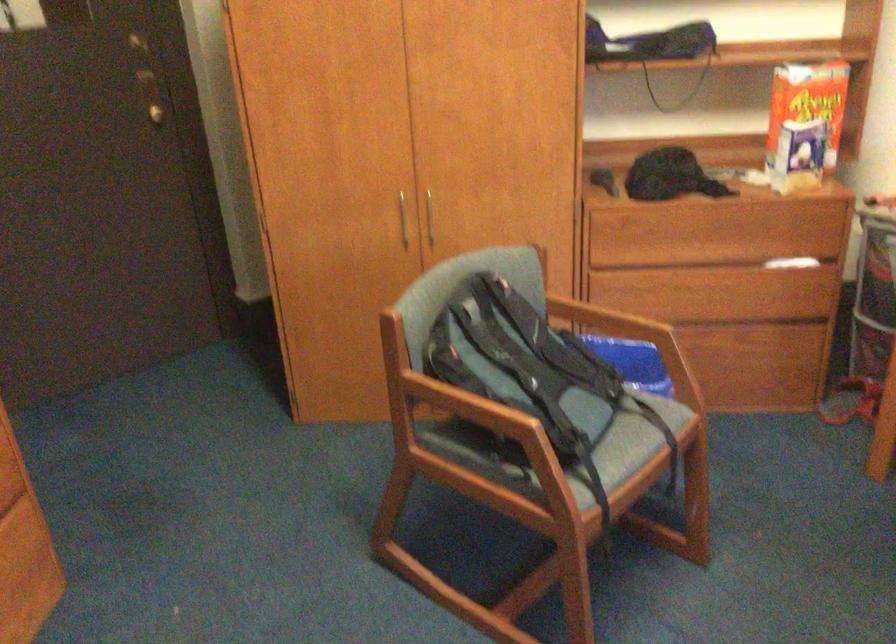
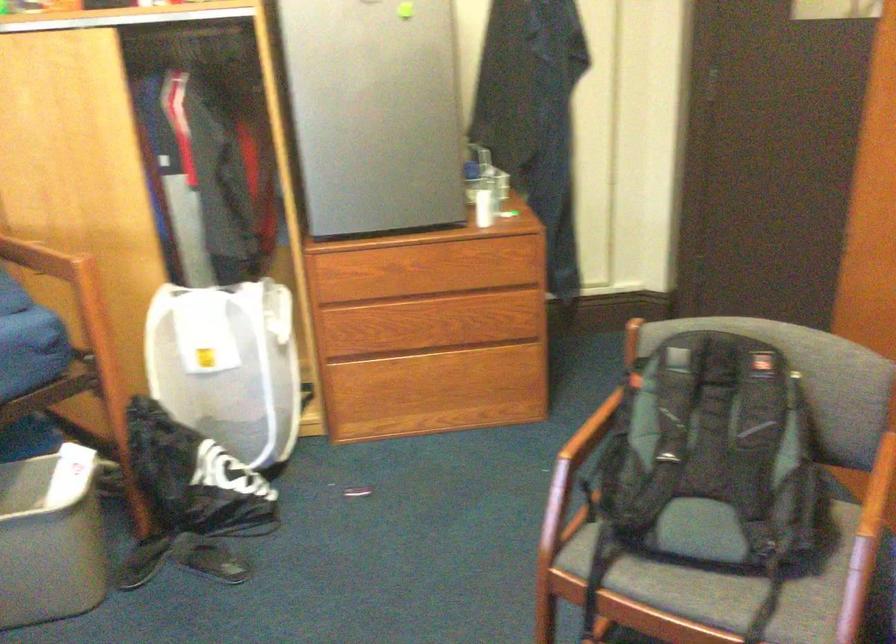
Find the pixel in the second image that matches point (636, 328) in the first image.

(871, 520)